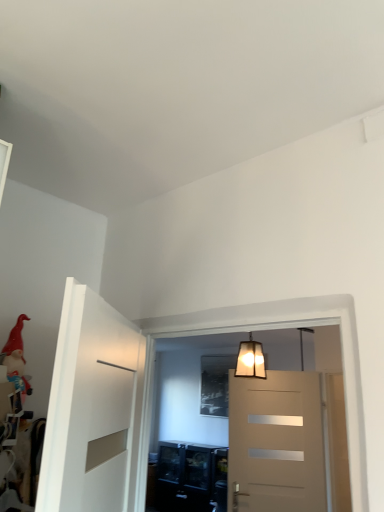
Describe the element at coordinates (250, 359) in the screenshot. Image resolution: width=384 pixels, height=512 pixels. I see `translucent glass lampshade at upper center` at that location.

This screenshot has height=512, width=384. I want to click on translucent glass lampshade at upper center, so [x=250, y=359].

What do you see at coordinates (16, 358) in the screenshot?
I see `red velvet santa hat at left` at bounding box center [16, 358].

This screenshot has height=512, width=384. In order to click on red velvet santa hat at left in this screenshot , I will do `click(16, 358)`.

Locate an element on the screen. The height and width of the screenshot is (512, 384). translucent glass lampshade at upper center is located at coordinates (250, 359).

Between translucent glass lampshade at upper center and red velvet santa hat at left, which one appears on the right side from the viewer's perspective?

translucent glass lampshade at upper center.

Is translucent glass lampshade at upper center positioned in front of red velvet santa hat at left?

No, translucent glass lampshade at upper center is further to the viewer.

Which is further, (242, 367) or (30, 388)?

The point (242, 367) is farther from the camera.

From the image's perspective, between translucent glass lampshade at upper center and red velvet santa hat at left, which one is located above?

From the image's view, red velvet santa hat at left is above.

Consider the image. From a real-world perspective, does translucent glass lampshade at upper center sit lower than red velvet santa hat at left?

No.

Which object is thinner, translucent glass lampshade at upper center or red velvet santa hat at left?

translucent glass lampshade at upper center.

Considering the sizes of objects translucent glass lampshade at upper center and red velvet santa hat at left in the image provided, who is taller, translucent glass lampshade at upper center or red velvet santa hat at left?

With more height is translucent glass lampshade at upper center.

Does translucent glass lampshade at upper center have a smaller size compared to red velvet santa hat at left?

Actually, translucent glass lampshade at upper center might be larger than red velvet santa hat at left.

From the picture: Would you say translucent glass lampshade at upper center is outside red velvet santa hat at left?

Yes.

Are translucent glass lampshade at upper center and red velvet santa hat at left located far from each other?

Absolutely, translucent glass lampshade at upper center is distant from red velvet santa hat at left.

Is translucent glass lampshade at upper center facing away from red velvet santa hat at left?

No, translucent glass lampshade at upper center is not facing the opposite direction of red velvet santa hat at left.

What's the angular difference between translucent glass lampshade at upper center and red velvet santa hat at left's facing directions?

The angular difference between translucent glass lampshade at upper center and red velvet santa hat at left is 0.00099 degrees.

Find the location of a particular element. The width and height of the screenshot is (384, 512). lamp below the red velvet santa hat at left (from the image's perspective) is located at coordinates (250, 359).

Which object is positioned more to the right, red velvet santa hat at left or translucent glass lampshade at upper center?

translucent glass lampshade at upper center.

Relative to translucent glass lampshade at upper center, is red velvet santa hat at left in front or behind?

Clearly, red velvet santa hat at left is in front of translucent glass lampshade at upper center.

Considering the positions of points (14, 335) and (254, 352), is point (14, 335) farther from camera compared to point (254, 352)?

No.

From the image's perspective, is red velvet santa hat at left above or below translucent glass lampshade at upper center?

Clearly, from the image's perspective, red velvet santa hat at left is above translucent glass lampshade at upper center.

From a real-world perspective, which object stands above the other?

translucent glass lampshade at upper center, from a real-world perspective.

Can you confirm if red velvet santa hat at left is wider than translucent glass lampshade at upper center?

Correct, the width of red velvet santa hat at left exceeds that of translucent glass lampshade at upper center.

Based on the photo, can you confirm if red velvet santa hat at left is shorter than translucent glass lampshade at upper center?

Yes.

Can you confirm if red velvet santa hat at left is bigger than translucent glass lampshade at upper center?

Incorrect, red velvet santa hat at left is not larger than translucent glass lampshade at upper center.

Is translucent glass lampshade at upper center inside red velvet santa hat at left?

No, translucent glass lampshade at upper center is not inside red velvet santa hat at left.

Is red velvet santa hat at left far away from translucent glass lampshade at upper center?

Absolutely, red velvet santa hat at left is distant from translucent glass lampshade at upper center.

Could you tell me if red velvet santa hat at left is facing translucent glass lampshade at upper center?

No, red velvet santa hat at left does not turn towards translucent glass lampshade at upper center.

Measure the distance between red velvet santa hat at left and translucent glass lampshade at upper center.

1.74 meters.

Locate an element on the screen. This screenshot has height=512, width=384. lamp lying behind the red velvet santa hat at left is located at coordinates (250, 359).

Where is `toy on the left side of translucent glass lampshade at upper center`? Image resolution: width=384 pixels, height=512 pixels. toy on the left side of translucent glass lampshade at upper center is located at coordinates (16, 358).

I want to click on toy located underneath the translucent glass lampshade at upper center (from a real-world perspective), so click(16, 358).